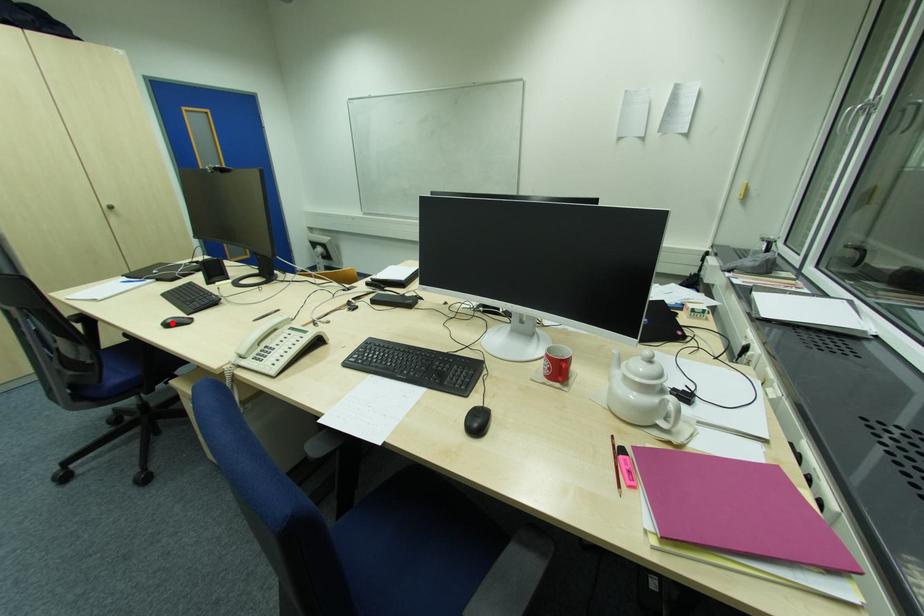
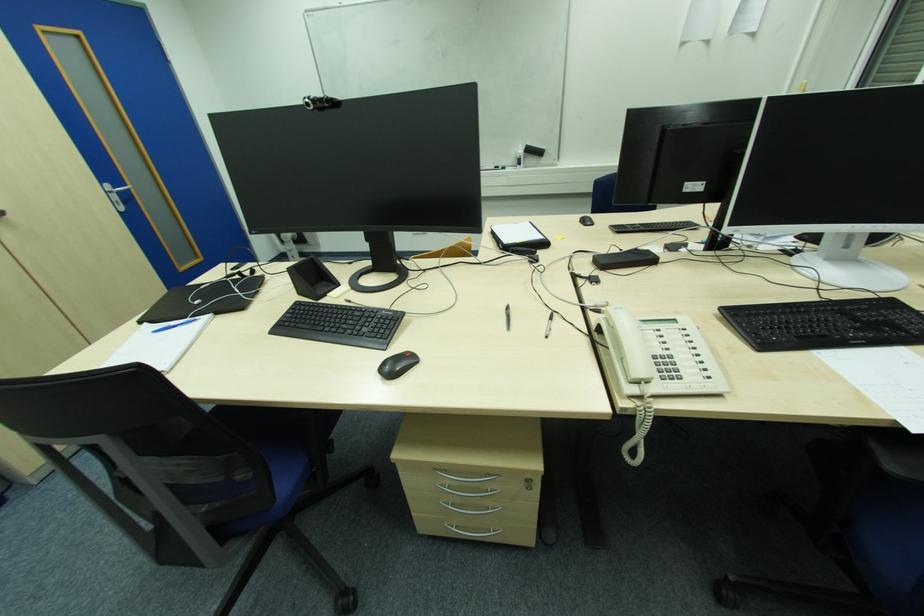
The point at the highlighted location is marked in the first image. Where is the corresponding point in the second image?

(388, 369)